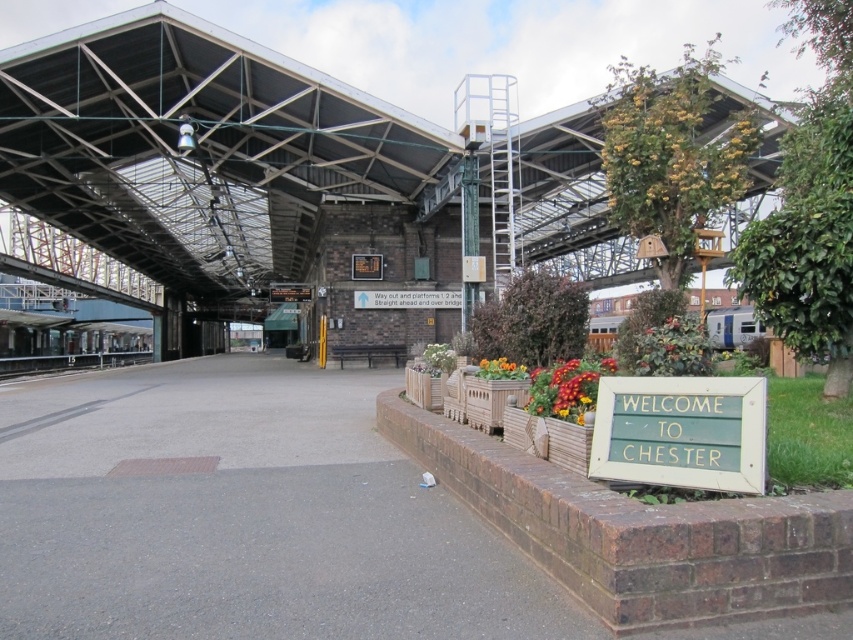
Question: Which object appears closest to the camera in this image?

Choices:
 (A) green wooden sign at lower right
 (B) black metal train track at left

Answer: (A)

Question: Does green wooden sign at lower right have a greater width compared to black metal train track at left?

Choices:
 (A) yes
 (B) no

Answer: (B)

Question: Is the position of green wooden sign at lower right less distant than that of black metal train track at left?

Choices:
 (A) yes
 (B) no

Answer: (A)

Question: Among these points, which one is nearest to the camera?

Choices:
 (A) click(x=102, y=360)
 (B) click(x=604, y=428)

Answer: (B)

Question: Can you confirm if green wooden sign at lower right is smaller than black metal train track at left?

Choices:
 (A) yes
 (B) no

Answer: (A)